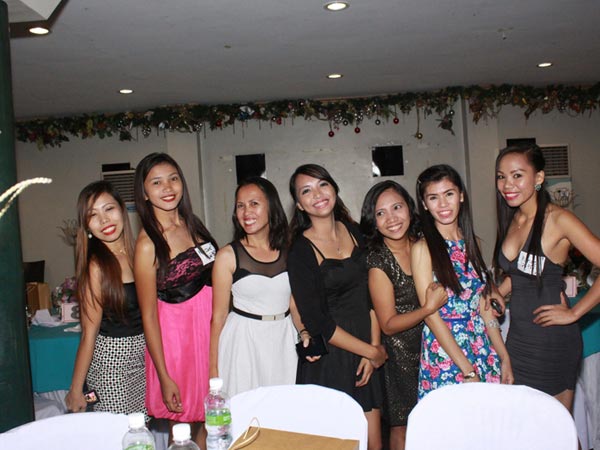
Identify the location of illuminated ceiling lights. The image size is (600, 450). (40, 30), (124, 91), (337, 4), (335, 75), (545, 62).